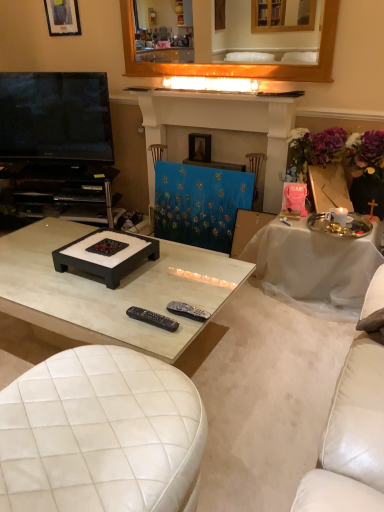
Locate an element on the screen. Image resolution: width=384 pixels, height=512 pixels. vacant space behind black plastic remote at center, the second remote control from the left is located at coordinates (189, 294).